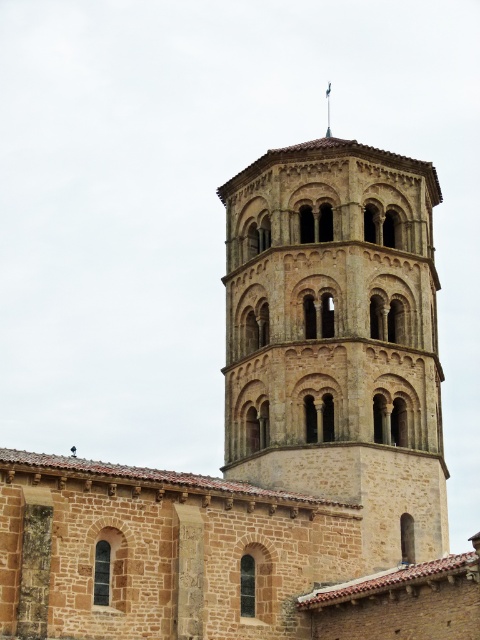
Question: Which point is closer to the camera taking this photo?

Choices:
 (A) (315, 248)
 (B) (330, 129)

Answer: (A)

Question: Which object is farther from the camera taking this photo?

Choices:
 (A) green stone spire at upper center
 (B) brown stone bell tower at center

Answer: (A)

Question: Is brown stone bell tower at center closer to the viewer compared to green stone spire at upper center?

Choices:
 (A) yes
 (B) no

Answer: (A)

Question: Observing the image, what is the correct spatial positioning of brown stone bell tower at center in reference to green stone spire at upper center?

Choices:
 (A) below
 (B) above

Answer: (A)

Question: Is brown stone bell tower at center thinner than green stone spire at upper center?

Choices:
 (A) yes
 (B) no

Answer: (B)